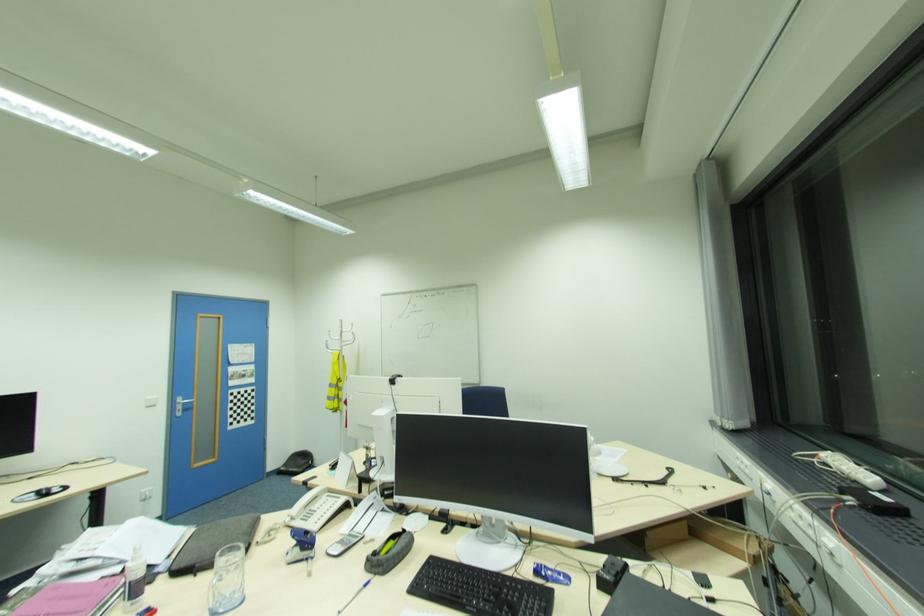
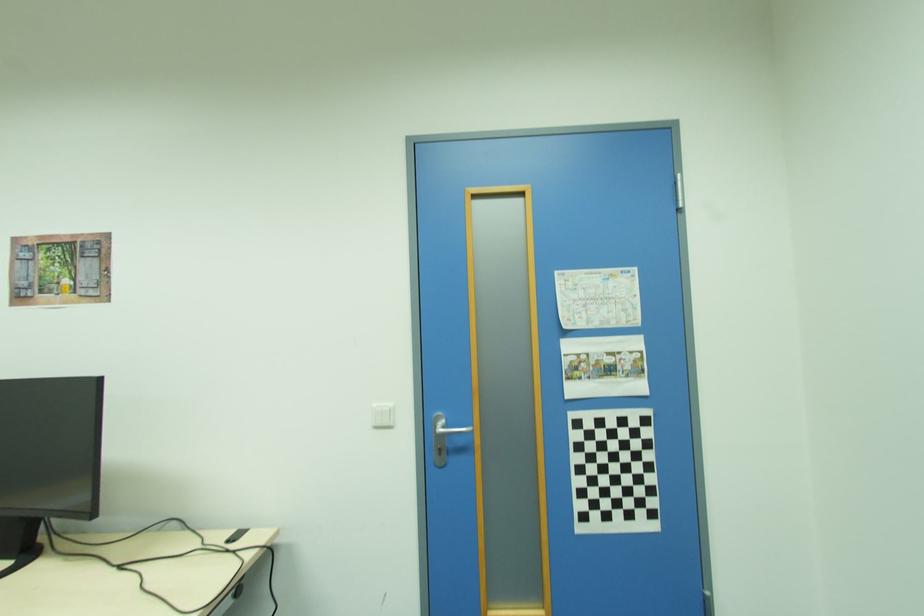
The point at [181,403] is marked in the first image. Where is the corresponding point in the second image?

(439, 429)